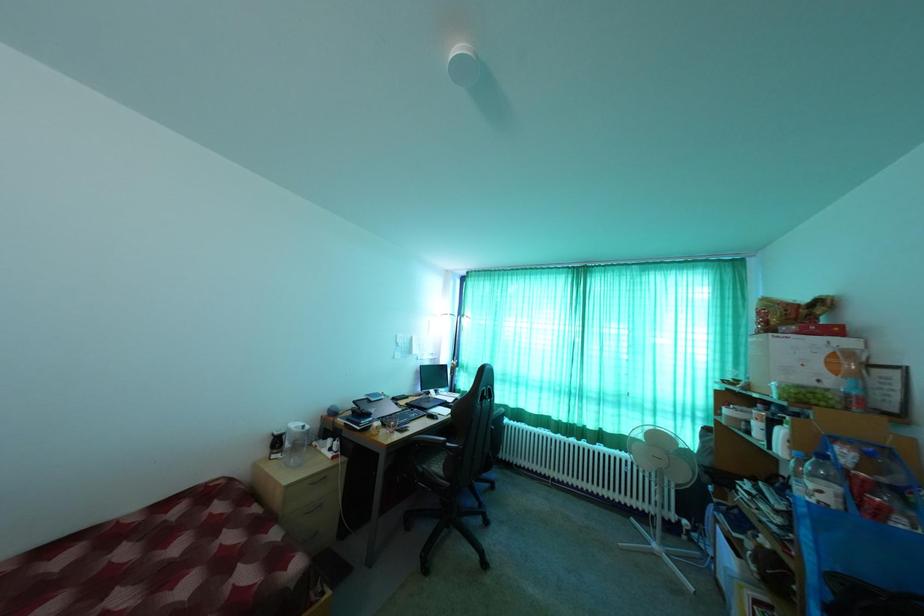
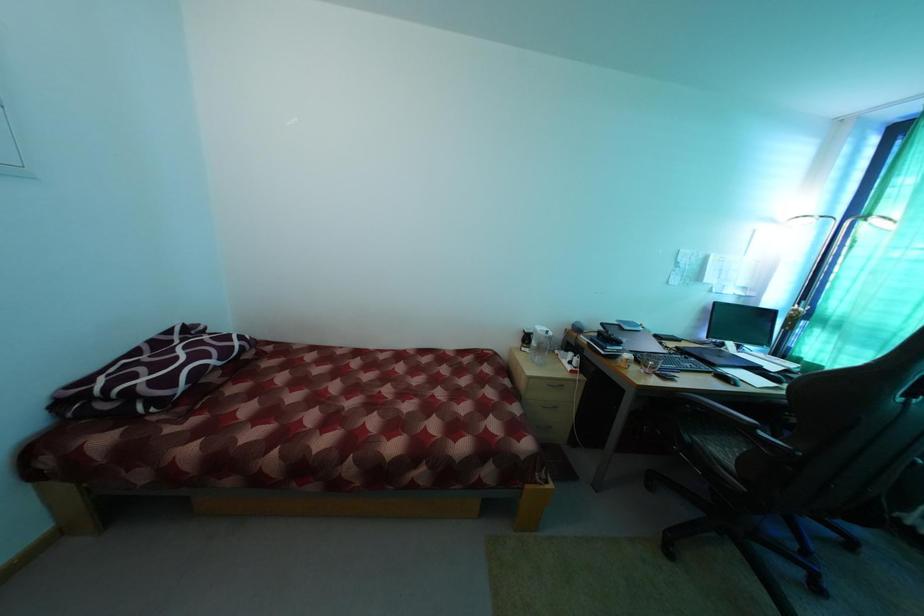
First-person continuous shooting, in which direction is the camera rotating?

The camera's rotation is toward left-down.